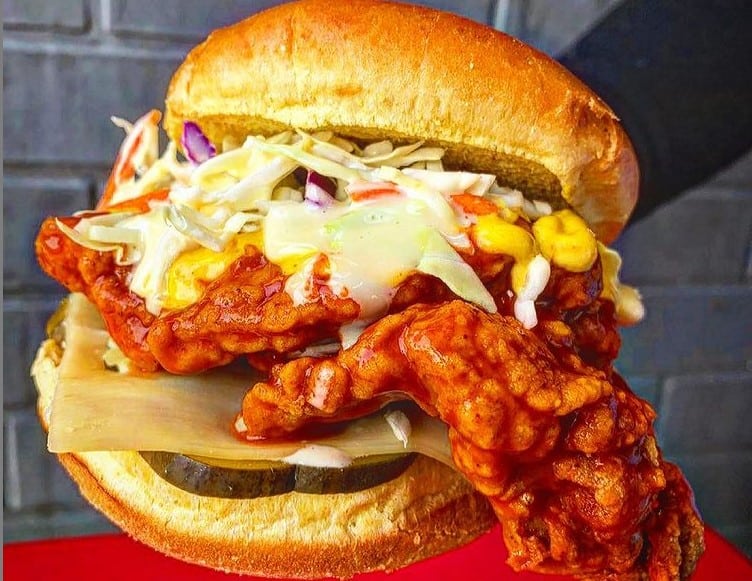
Locate an element on the screen. This screenshot has height=581, width=752. table is located at coordinates (80, 553).